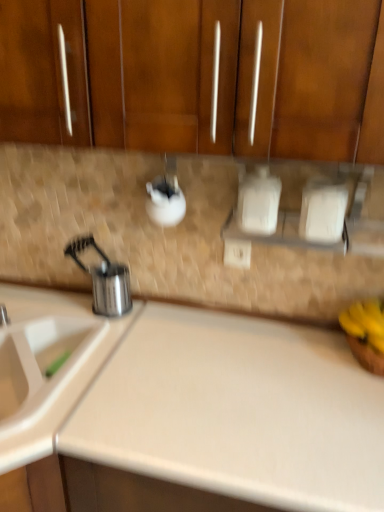
Question: From the image's perspective, is white plastic electric outlet at center located beneath white plastic sink at lower left?

Choices:
 (A) yes
 (B) no

Answer: (B)

Question: Is white plastic electric outlet at center oriented towards white plastic sink at lower left?

Choices:
 (A) yes
 (B) no

Answer: (B)

Question: Is white plastic electric outlet at center not inside white plastic sink at lower left?

Choices:
 (A) yes
 (B) no

Answer: (A)

Question: Considering the relative positions of white plastic electric outlet at center and white plastic sink at lower left in the image provided, is white plastic electric outlet at center to the left of white plastic sink at lower left from the viewer's perspective?

Choices:
 (A) no
 (B) yes

Answer: (A)

Question: Is white plastic electric outlet at center taller than white plastic sink at lower left?

Choices:
 (A) no
 (B) yes

Answer: (A)

Question: Considering the relative positions of white plastic electric outlet at center and white plastic sink at lower left in the image provided, is white plastic electric outlet at center to the right of white plastic sink at lower left from the viewer's perspective?

Choices:
 (A) no
 (B) yes

Answer: (B)

Question: Can you confirm if brushed metal tap at left is positioned to the left of white plastic electric outlet at center?

Choices:
 (A) yes
 (B) no

Answer: (A)

Question: From a real-world perspective, is brushed metal tap at left physically above white plastic electric outlet at center?

Choices:
 (A) no
 (B) yes

Answer: (A)

Question: Considering the relative sizes of brushed metal tap at left and white plastic electric outlet at center in the image provided, is brushed metal tap at left taller than white plastic electric outlet at center?

Choices:
 (A) yes
 (B) no

Answer: (B)

Question: Is brushed metal tap at left not near white plastic electric outlet at center?

Choices:
 (A) yes
 (B) no

Answer: (B)

Question: Considering the relative sizes of brushed metal tap at left and white plastic electric outlet at center in the image provided, is brushed metal tap at left wider than white plastic electric outlet at center?

Choices:
 (A) no
 (B) yes

Answer: (B)

Question: Is brushed metal tap at left facing towards white plastic electric outlet at center?

Choices:
 (A) no
 (B) yes

Answer: (A)

Question: Considering the relative sizes of white plastic sink at lower left and beige laminate counter top at center in the image provided, is white plastic sink at lower left thinner than beige laminate counter top at center?

Choices:
 (A) no
 (B) yes

Answer: (A)